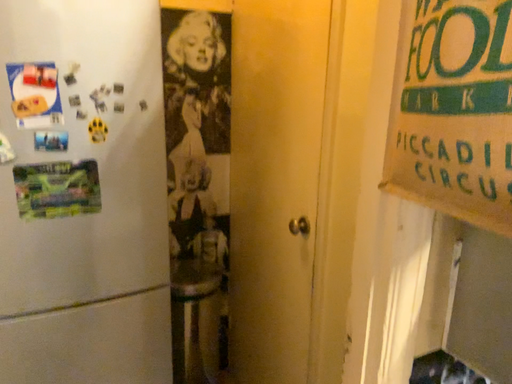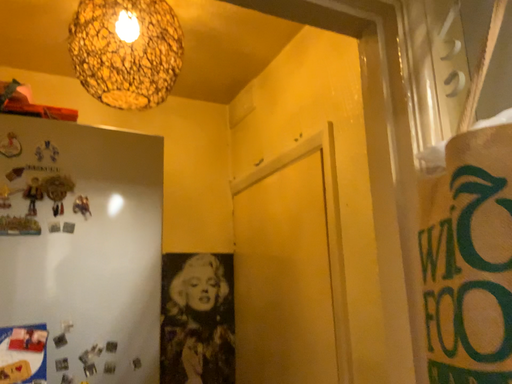
Question: How did the camera likely rotate when shooting the video?

Choices:
 (A) rotated upward
 (B) rotated downward

Answer: (A)